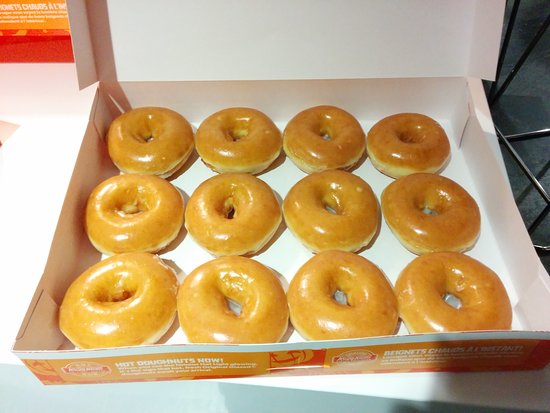
I want to click on white countertop, so click(41, 161).